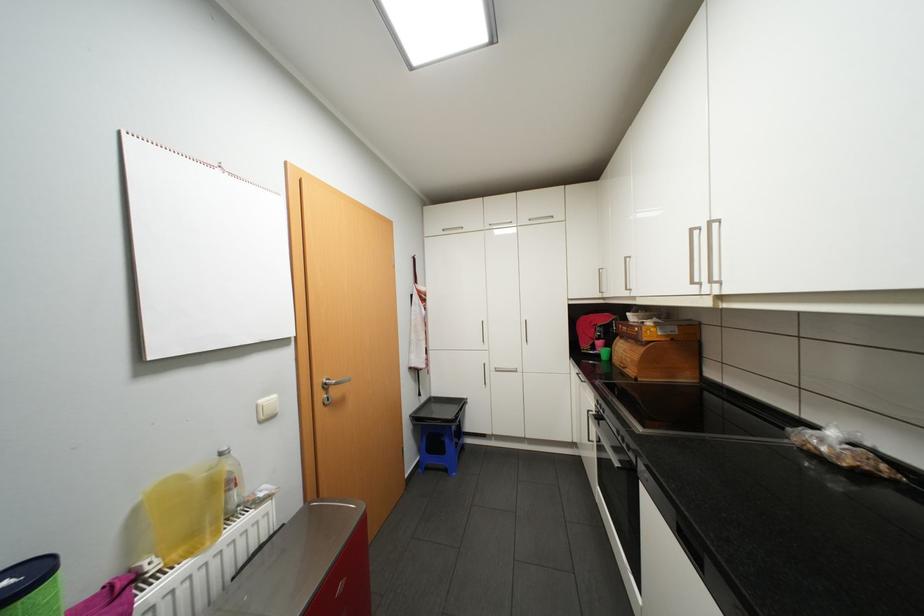
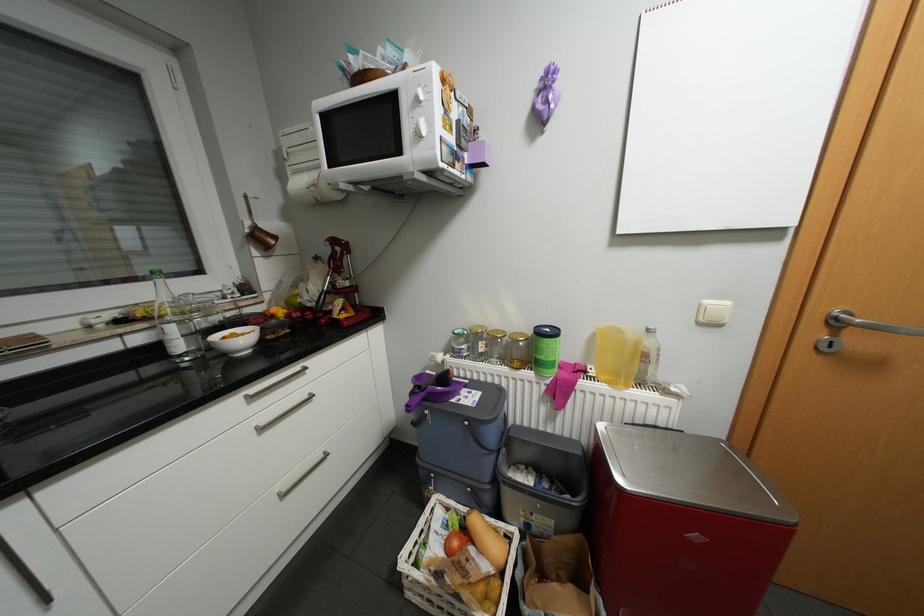
Locate, in the second image, the point that corresponds to point (162, 565) in the first image.

(600, 371)